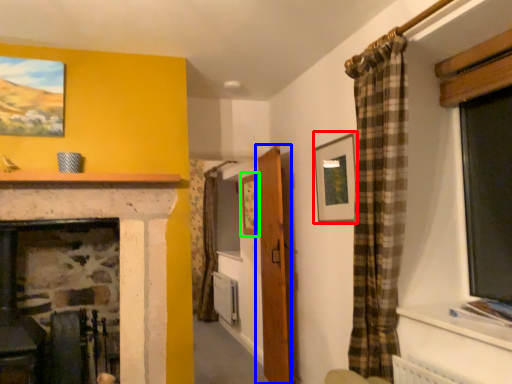
Question: Estimate the real-world distances between objects in this image. Which object is closer to picture frame (highlighted by a red box), door (highlighted by a blue box) or picture frame (highlighted by a green box)?

Choices:
 (A) door
 (B) picture frame

Answer: (A)